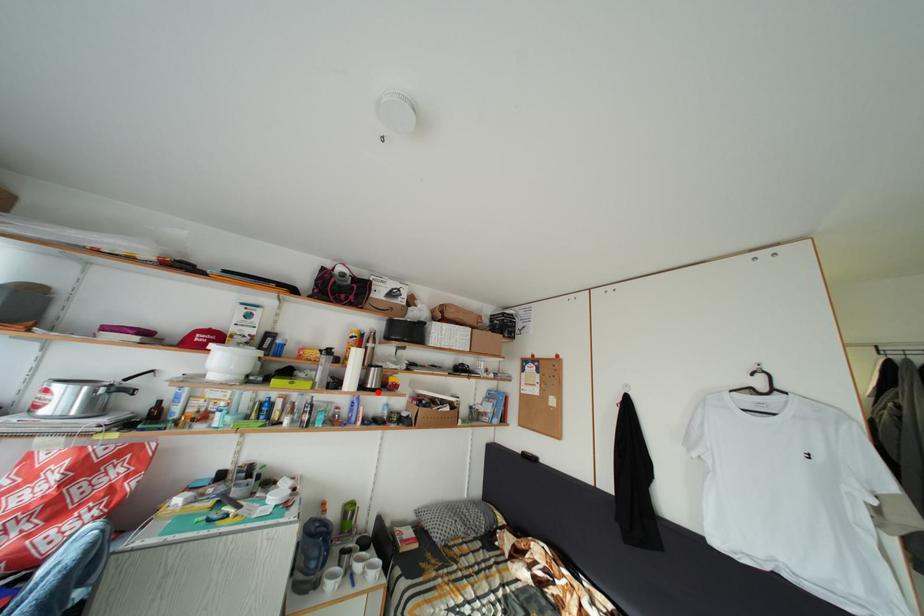
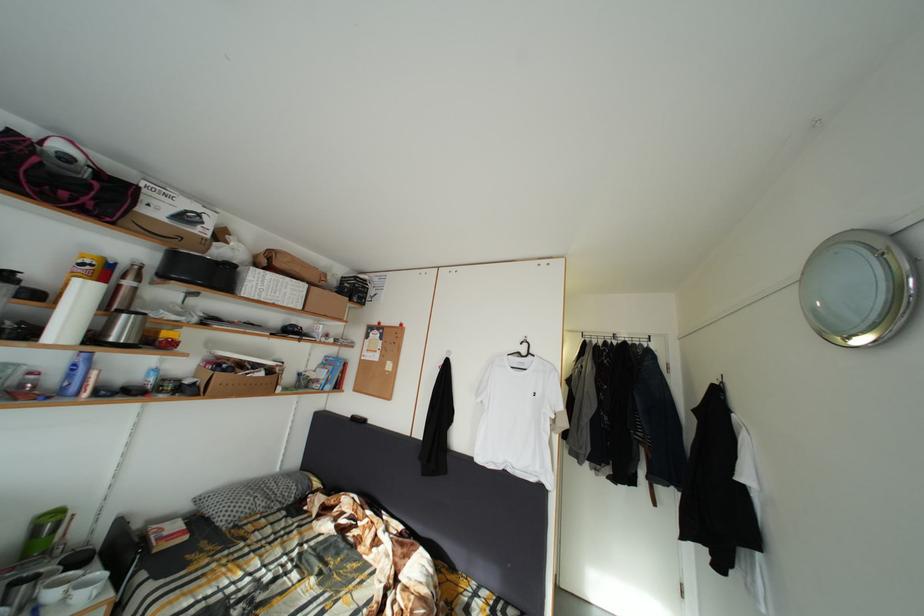
Locate, in the second image, the point that corresponds to the highlighted location in the first image.

(120, 345)